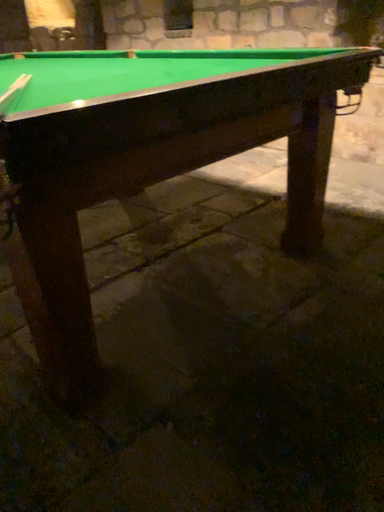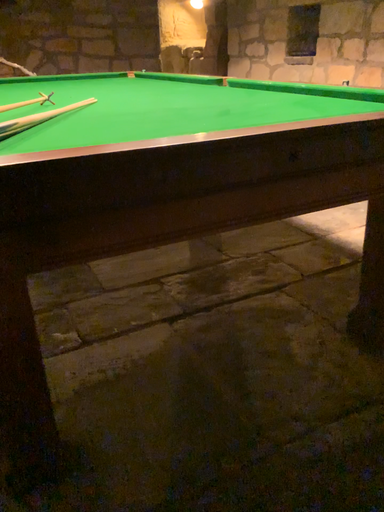
Question: Which way did the camera rotate in the video?

Choices:
 (A) rotated right
 (B) rotated left

Answer: (B)